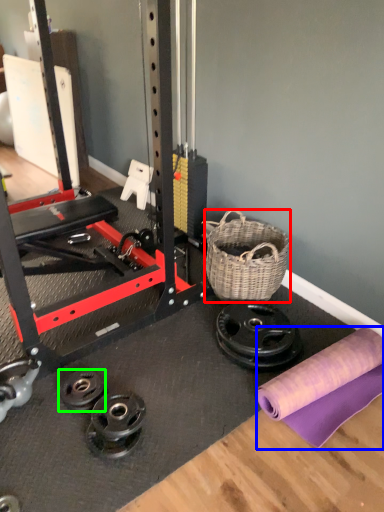
Question: Which is farther away from basket (highlighted by a red box)? fabric (highlighted by a blue box) or wheel (highlighted by a green box)?

Choices:
 (A) fabric
 (B) wheel

Answer: (B)